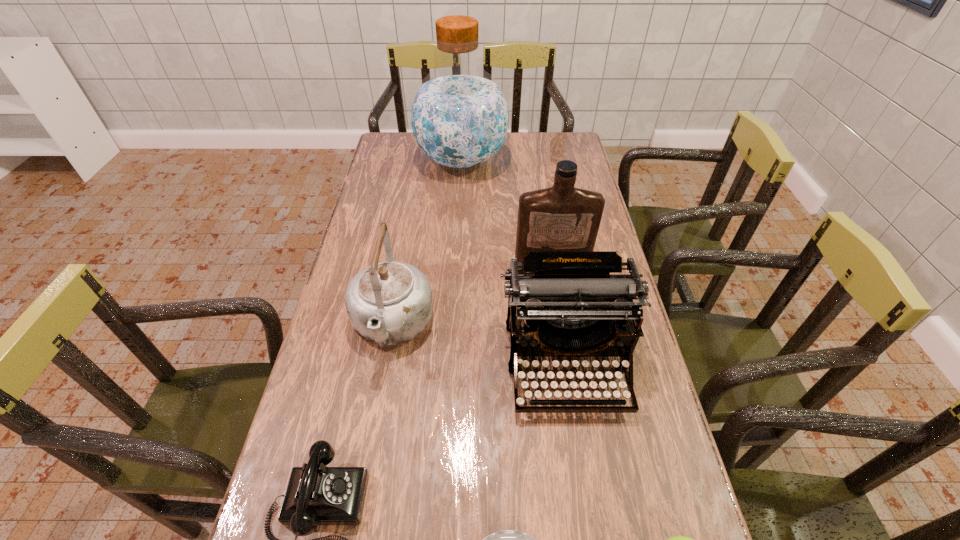
Locate an element on the screen. object present at the far edge is located at coordinates (459, 116).

Locate an element on the screen. water jug that is positioned at the left edge is located at coordinates (459, 116).

Identify the location of kettle present at the left edge. The height and width of the screenshot is (540, 960). (388, 303).

Locate an element on the screen. The height and width of the screenshot is (540, 960). liquor that is at the right edge is located at coordinates (561, 218).

In order to click on typewriter present at the right edge in this screenshot , I will do `click(572, 306)`.

Where is `object that is at the far left corner`? The height and width of the screenshot is (540, 960). object that is at the far left corner is located at coordinates (459, 116).

At what (x,y) coordinates should I click in order to perform the action: click on vacant space at the left edge of the desktop. Please return your answer as a coordinate pair (x, y). This screenshot has width=960, height=540. Looking at the image, I should click on pyautogui.click(x=388, y=183).

Find the location of a particular element. vacant space at the right edge of the desktop is located at coordinates (590, 187).

Find the location of `vacant space at the far right corner of the desktop`. vacant space at the far right corner of the desktop is located at coordinates (571, 137).

The height and width of the screenshot is (540, 960). Find the location of `vacant area that lies between the typewriter and the kettle`. vacant area that lies between the typewriter and the kettle is located at coordinates (479, 345).